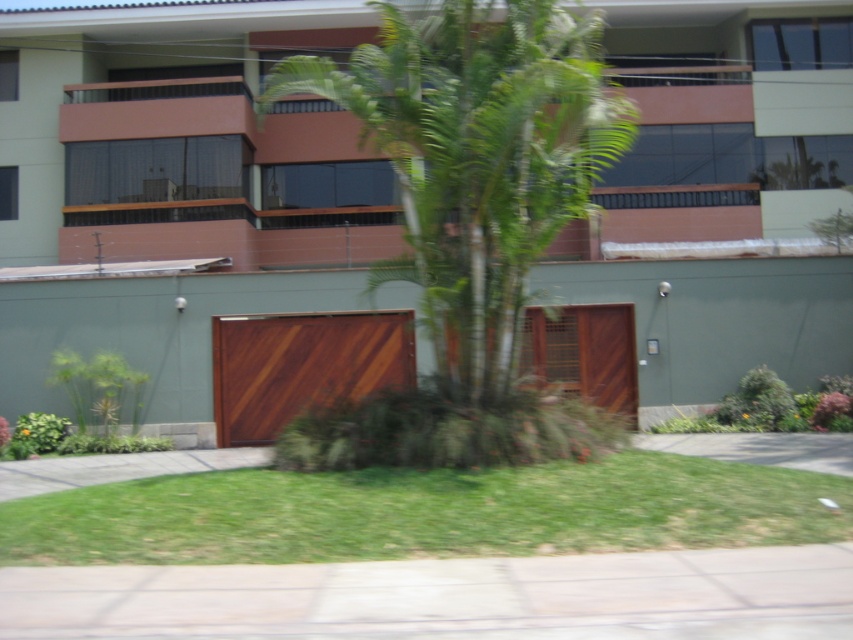
Question: Is concrete at lower center positioned in front of gray concrete driveway at lower center?

Choices:
 (A) no
 (B) yes

Answer: (B)

Question: Is green grass at lower center to the right of concrete at lower center from the viewer's perspective?

Choices:
 (A) no
 (B) yes

Answer: (A)

Question: Which object is positioned farthest from the gray concrete driveway at lower center?

Choices:
 (A) green leafy palm tree at center
 (B) wooden at center

Answer: (A)

Question: Among these objects, which one is farthest from the camera?

Choices:
 (A) concrete at lower center
 (B) gray concrete driveway at lower center

Answer: (B)

Question: Can you confirm if green grass at lower center is positioned above gray concrete driveway at lower center?

Choices:
 (A) yes
 (B) no

Answer: (A)

Question: Among these objects, which one is farthest from the camera?

Choices:
 (A) green leafy palm tree at center
 (B) wooden slats at center
 (C) gray concrete driveway at lower center

Answer: (B)